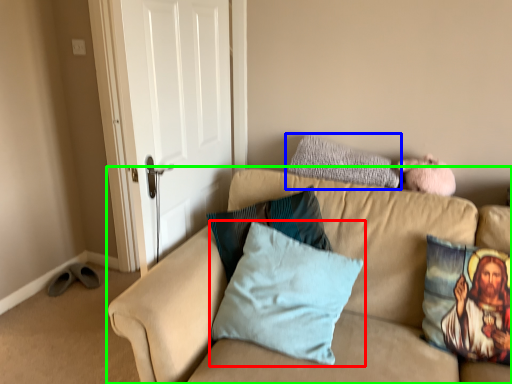
Question: Which is farther away from pillow (highlighted by a red box)? pillow (highlighted by a blue box) or studio couch (highlighted by a green box)?

Choices:
 (A) pillow
 (B) studio couch

Answer: (A)